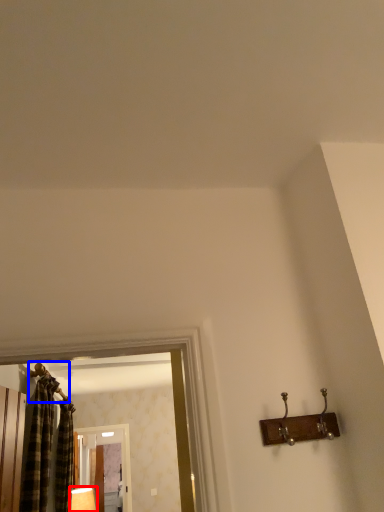
Question: Which object is closer to the camera taking this photo, lamp (highlighted by a red box) or hanger (highlighted by a blue box)?

Choices:
 (A) lamp
 (B) hanger

Answer: (B)